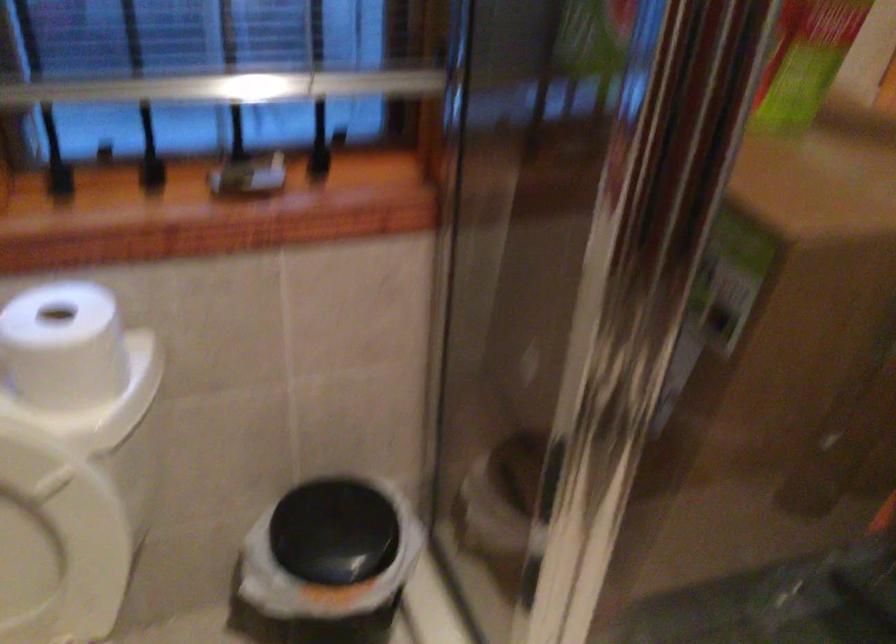
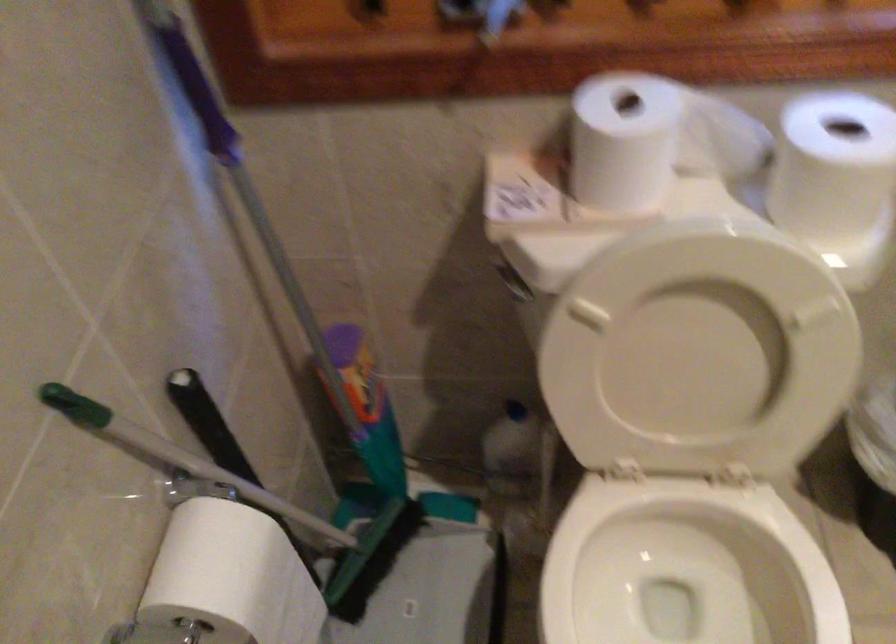
Question: What movement of the cameraman would produce the second image?

Choices:
 (A) Left
 (B) Right
 (C) Forward
 (D) Backward

Answer: (A)